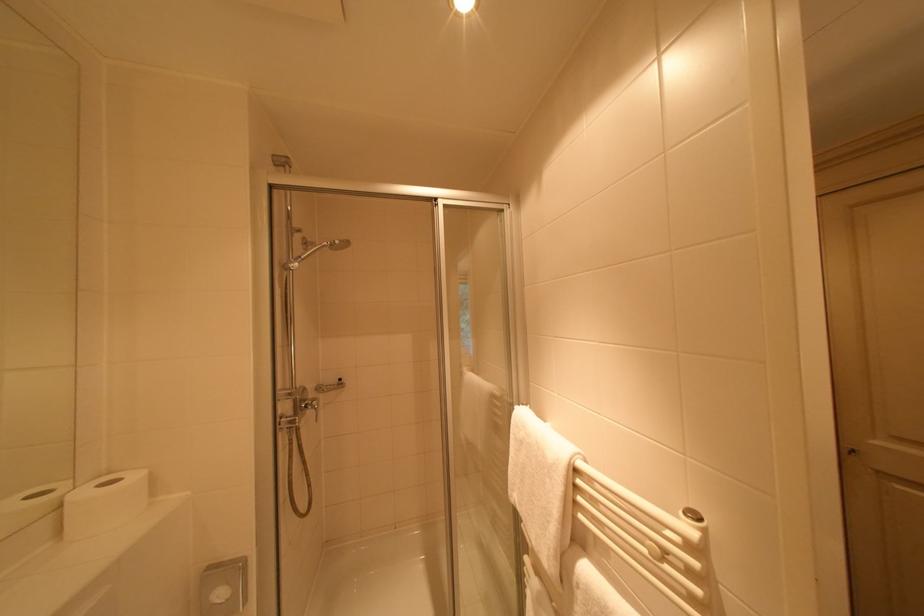
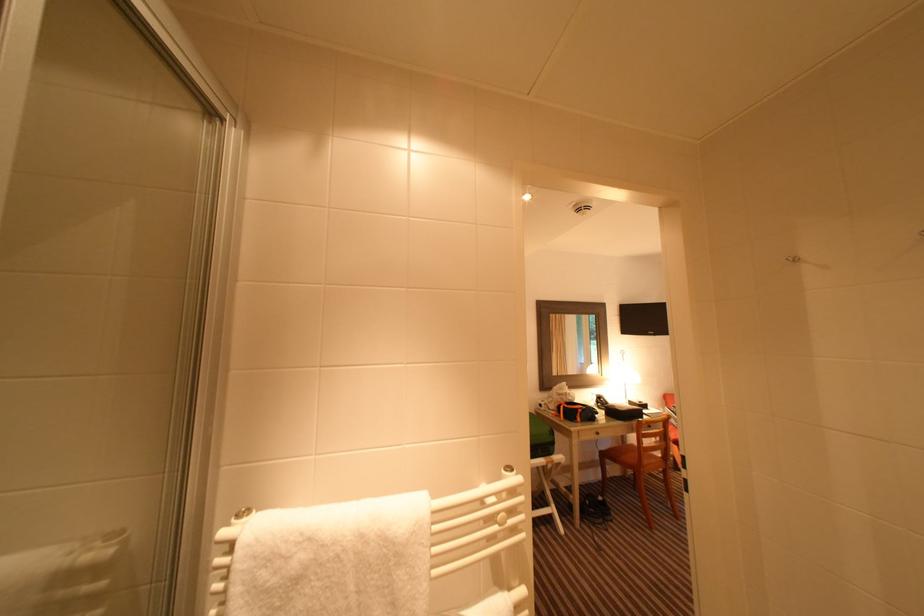
Question: The camera is either moving clockwise (left) or counter-clockwise (right) around the object. The first image is from the beginning of the video and the second image is from the end. Is the camera moving left or right when shooting the video?

Choices:
 (A) Left
 (B) Right

Answer: (A)